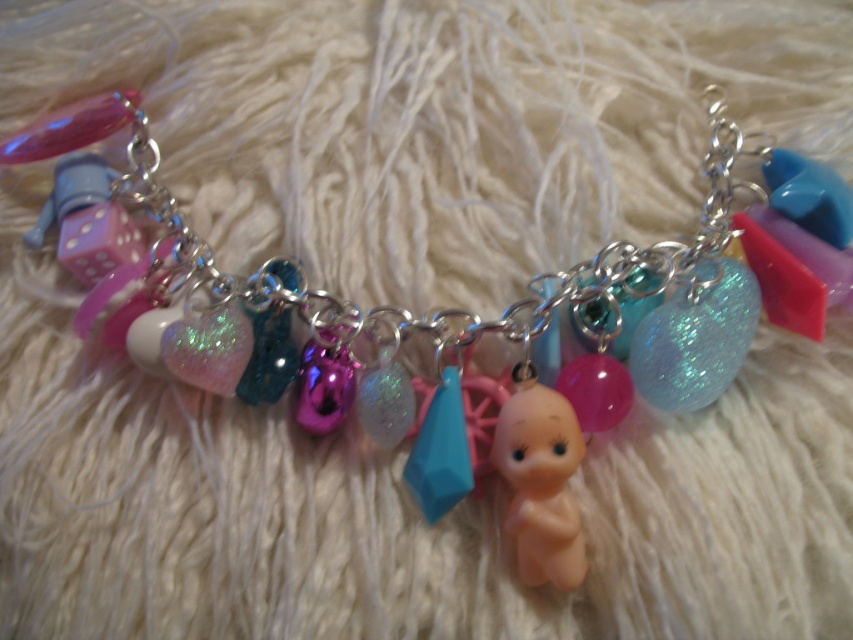
Question: Can you confirm if pink rubber doll at center is wider than glittery blue sphere at center?

Choices:
 (A) yes
 (B) no

Answer: (B)

Question: Which object is the farthest from the pink rubber doll at center?

Choices:
 (A) glittery blue sphere at center
 (B) pink matte dice at center

Answer: (B)

Question: Which point appears closest to the camera in this image?

Choices:
 (A) (138, 234)
 (B) (694, 310)
 (C) (526, 484)

Answer: (C)

Question: Where is glittery blue sphere at center located in relation to pink matte dice at center in the image?

Choices:
 (A) below
 (B) above

Answer: (A)

Question: Is pink rubber doll at center to the right of pink matte dice at center from the viewer's perspective?

Choices:
 (A) no
 (B) yes

Answer: (B)

Question: Which object is the closest to the glittery blue sphere at center?

Choices:
 (A) pink rubber doll at center
 (B) pink matte dice at center

Answer: (A)